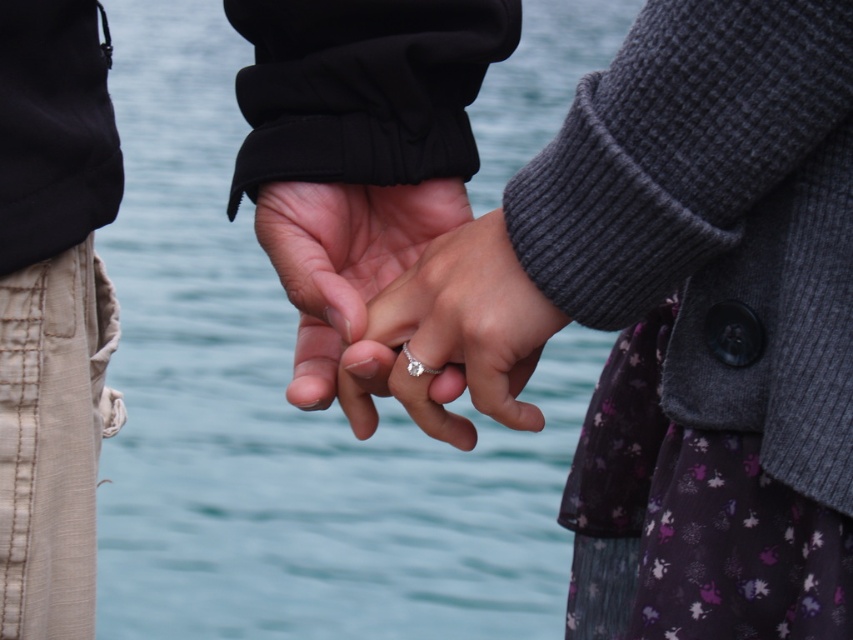
Question: Observing the image, what is the correct spatial positioning of blue water at center in reference to silver metallic ring at center?

Choices:
 (A) left
 (B) right

Answer: (A)

Question: Which object is closer to the camera taking this photo?

Choices:
 (A) blue water at center
 (B) silver metallic ring at center
 (C) diamond silver ring at center
 (D) matte silver ring at center

Answer: (B)

Question: Which of the following is the closest to the observer?

Choices:
 (A) matte silver ring at center
 (B) diamond silver ring at center
 (C) silver metallic ring at center

Answer: (C)

Question: Is blue water at center further to camera compared to silver metallic ring at center?

Choices:
 (A) yes
 (B) no

Answer: (A)

Question: Is silver metallic ring at center to the right of matte silver ring at center from the viewer's perspective?

Choices:
 (A) yes
 (B) no

Answer: (A)

Question: Among these points, which one is farthest from the camera?

Choices:
 (A) (498, 300)
 (B) (410, 362)
 (C) (152, 241)
 (D) (292, 268)

Answer: (C)